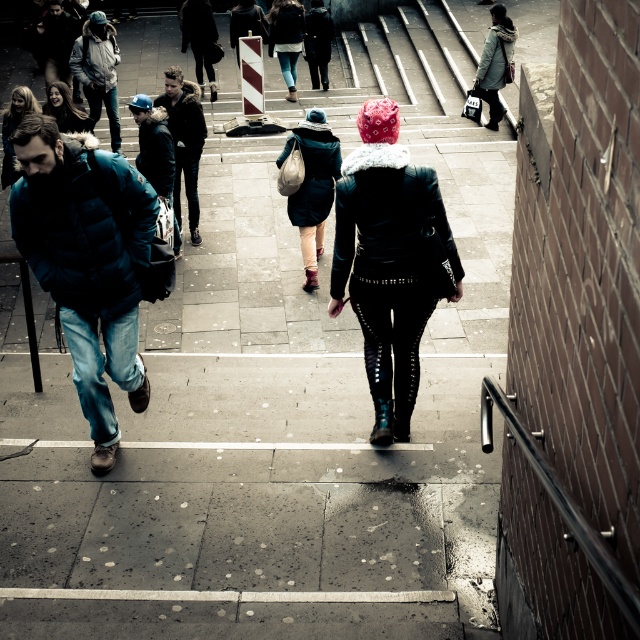
Question: Which object appears closest to the camera in this image?

Choices:
 (A) dark blue jacket at center
 (B) matte black jacket at upper left
 (C) short blonde hair at center

Answer: (B)

Question: Is matte black coat at center wider than short blonde hair at center?

Choices:
 (A) no
 (B) yes

Answer: (B)

Question: Which of the following is the farthest from the observer?

Choices:
 (A) matte black jacket at upper left
 (B) denim jacket at center
 (C) dark blue jacket at center
 (D) dark brown hair at center

Answer: (B)

Question: Is denim jacket at center in front of short blonde hair at center?

Choices:
 (A) yes
 (B) no

Answer: (B)

Question: Which of the following is the closest to the observer?

Choices:
 (A) matte black jacket at left
 (B) matte black coat at center
 (C) leather jacket at center

Answer: (C)

Question: Is denim jacket at center further to camera compared to matte black jacket at upper left?

Choices:
 (A) yes
 (B) no

Answer: (A)